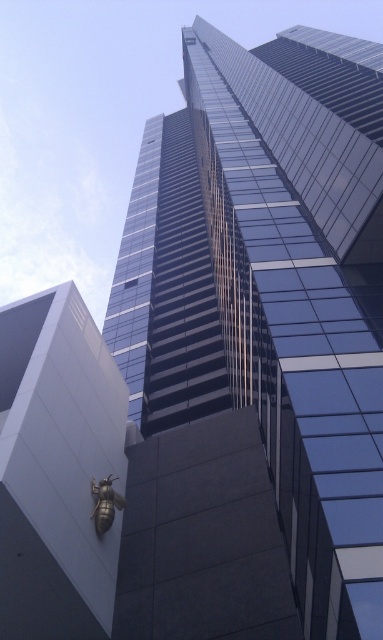
Question: Does glassy blue skyscraper at center have a larger size compared to gold metallic bee at lower left?

Choices:
 (A) no
 (B) yes

Answer: (B)

Question: Where is glassy blue skyscraper at center located in relation to gold metallic bee at lower left in the image?

Choices:
 (A) below
 (B) above

Answer: (B)

Question: Does glassy blue skyscraper at center have a larger size compared to gold metallic bee at lower left?

Choices:
 (A) no
 (B) yes

Answer: (B)

Question: Which point is farther to the camera?

Choices:
 (A) (340, 353)
 (B) (27, 568)

Answer: (A)